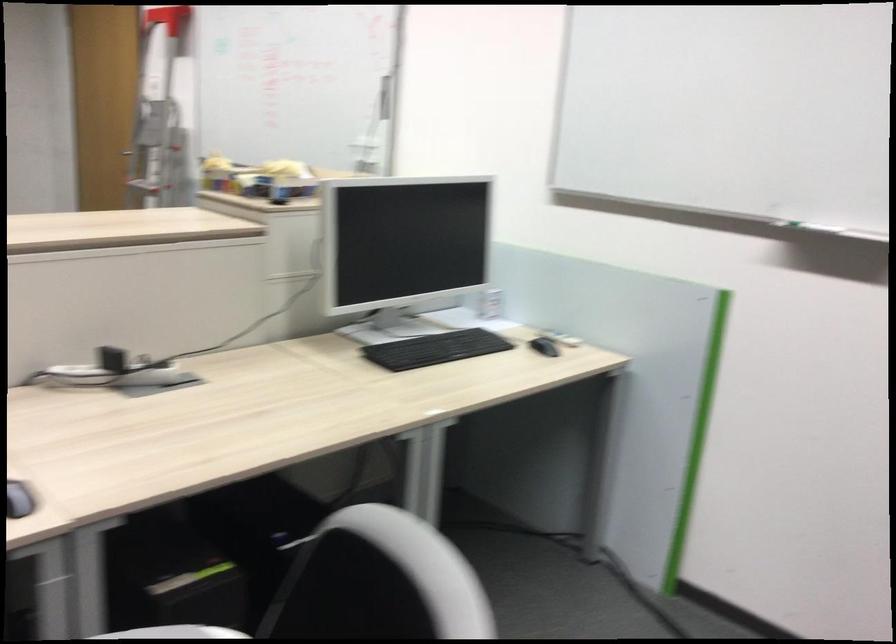
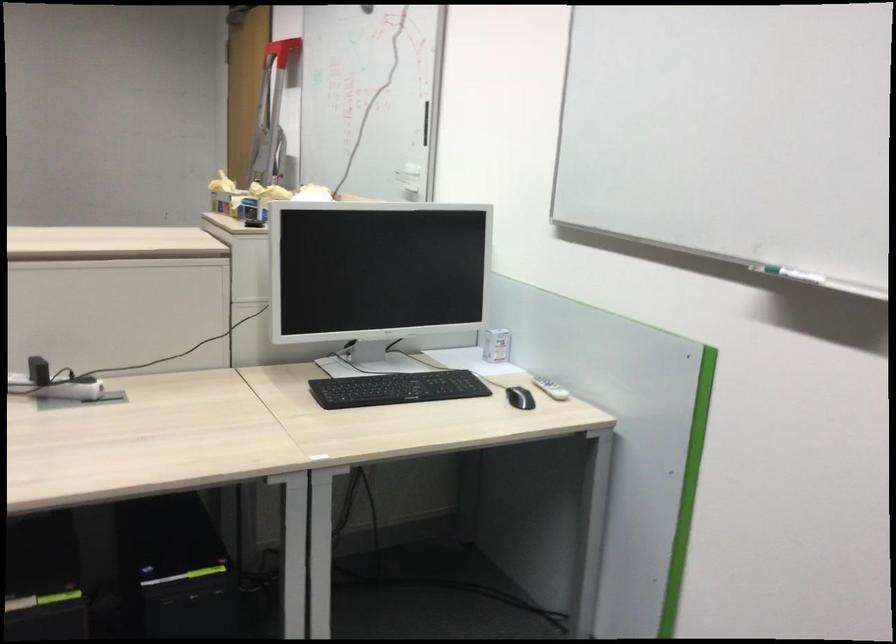
Locate, in the second image, the point that corresponds to the point at 384,99 in the first image.

(426, 122)